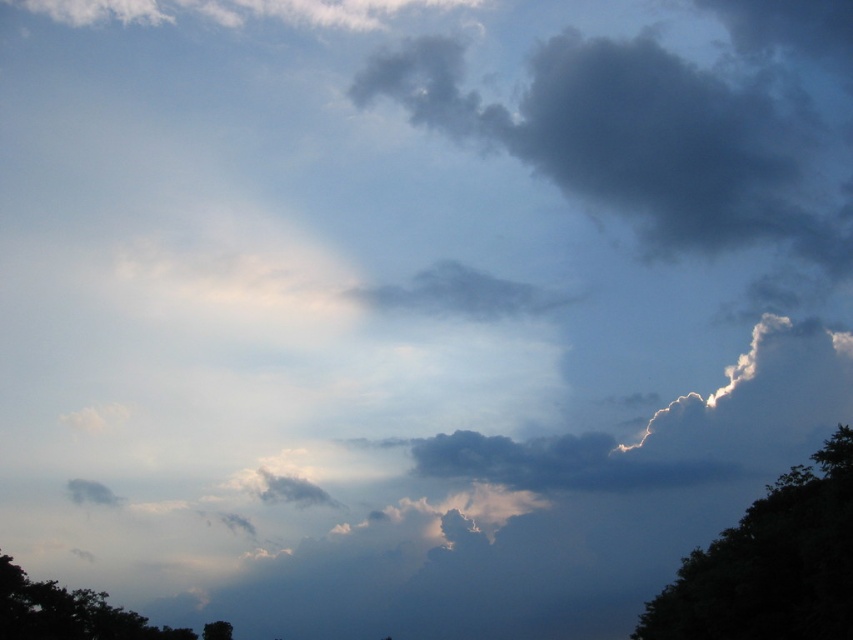
You are standing in the lower part of the image where the silhouettes of trees are visible. You want to walk towards the dark green leafy tree at right. Which direction should you move relative to your current position?

The dark green leafy tree at right is located at point 0.881 on the x and 0.905 on the y coordinate. Since you are in the lower part of the image, moving upwards and towards the right would lead you closer to the tree.

You are an artist trying to paint this scene. You need to decide which object should be wider in your painting to maintain accuracy. Which object should you make wider between the dark gray fluffy cloud at upper center and the dark green leafy tree at right?

The dark gray fluffy cloud at upper center should be made wider in the painting because its width surpasses that of the dark green leafy tree at right according to the description.